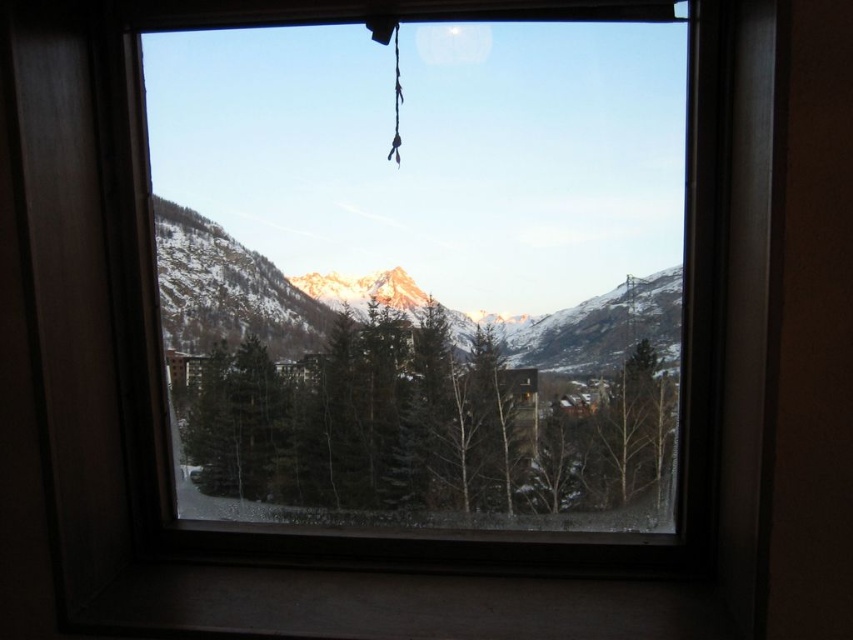
Question: Can you confirm if green matte tree at center is wider than snowy mountain at center?

Choices:
 (A) yes
 (B) no

Answer: (B)

Question: Is green matte tree at center positioned in front of snowy mountain at center?

Choices:
 (A) no
 (B) yes

Answer: (A)

Question: Which point is closer to the camera?

Choices:
 (A) (482, 404)
 (B) (193, 316)

Answer: (B)

Question: Is green matte tree at center in front of snowy mountain at center?

Choices:
 (A) yes
 (B) no

Answer: (B)